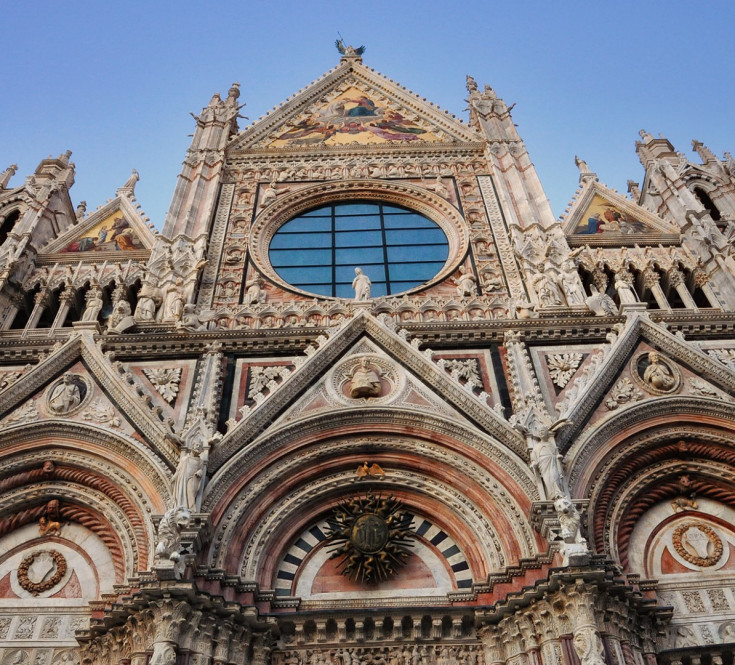
At what (x,y) coordinates should I click in order to perform the action: click on fresco painting. Please return your answer as a coordinate pair (x, y). Looking at the image, I should click on (364, 120), (115, 235), (603, 207).